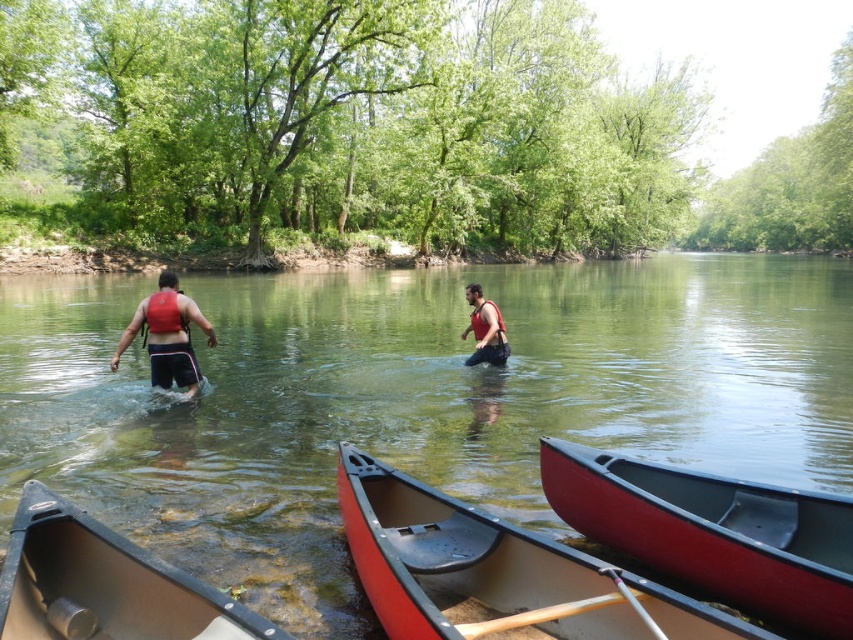
You are standing on the riverbank and want to choose the matte red canoe at lower center to start your journey. According to the coordinates provided, where exactly should you look to find it?

The matte red canoe at lower center is located at point (495, 572).